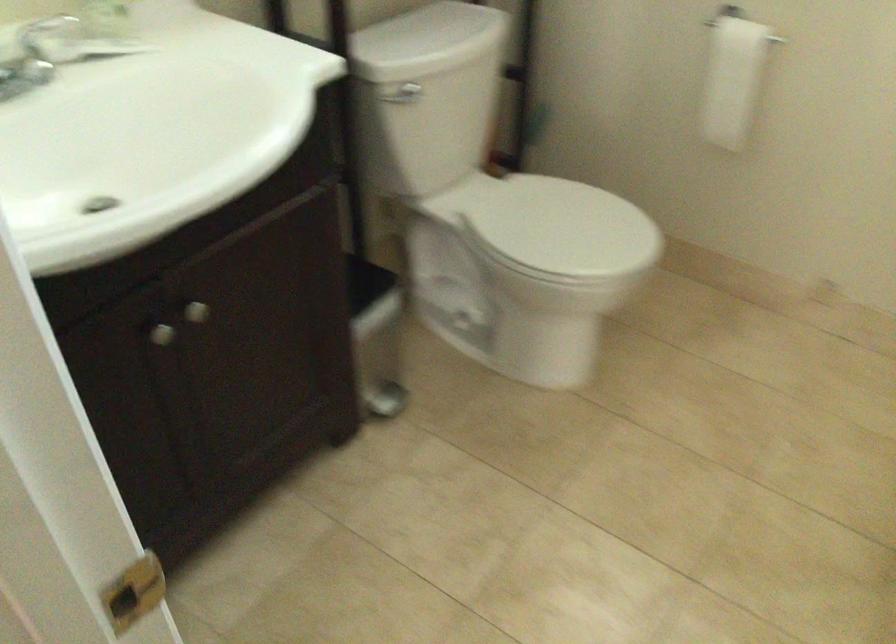
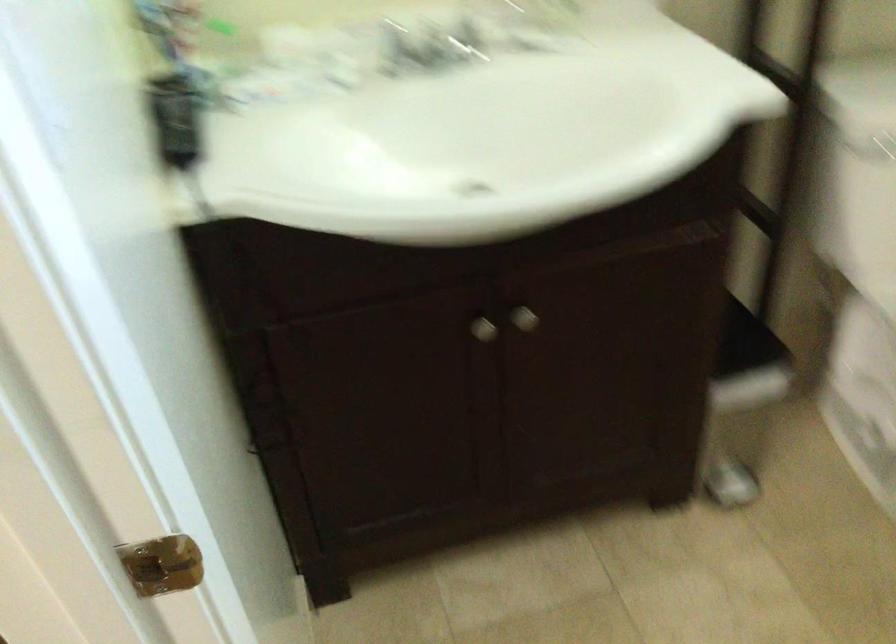
Question: Based on the continuous images, in which direction is the camera rotating? Reply with the corresponding letter.

Choices:
 (A) Left
 (B) Right
 (C) Up
 (D) Down

Answer: (A)